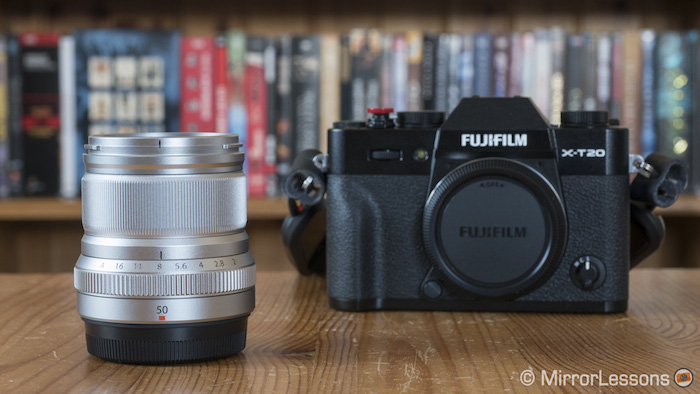
What are the coordinates of `table` in the screenshot? It's located at (336, 345).